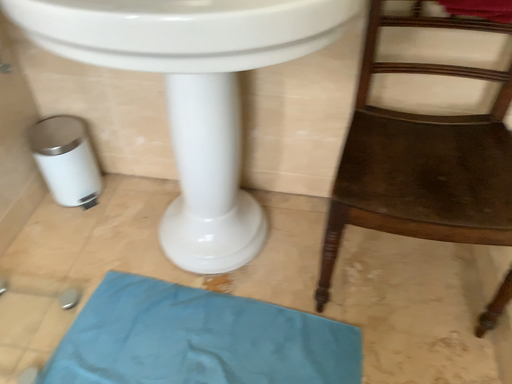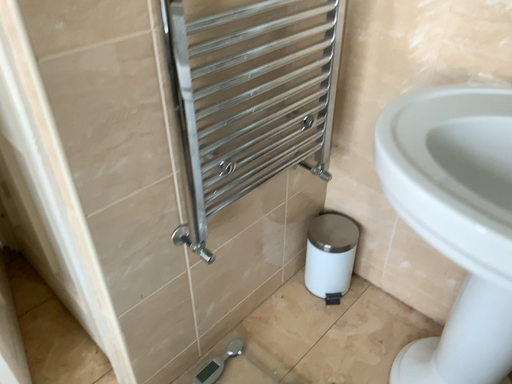
Question: How did the camera likely rotate when shooting the video?

Choices:
 (A) rotated downward
 (B) rotated upward

Answer: (B)